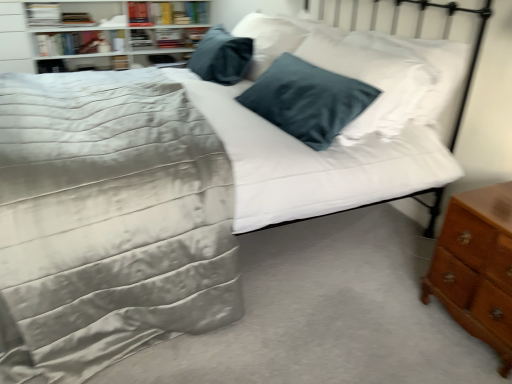
Question: From the image's perspective, is brown wooden nightstand at lower right located beneath white glossy bookshelf at upper left?

Choices:
 (A) no
 (B) yes

Answer: (B)

Question: From a real-world perspective, is brown wooden nightstand at lower right over white glossy bookshelf at upper left?

Choices:
 (A) yes
 (B) no

Answer: (B)

Question: Is brown wooden nightstand at lower right surrounding white glossy bookshelf at upper left?

Choices:
 (A) yes
 (B) no

Answer: (B)

Question: Can you confirm if brown wooden nightstand at lower right is bigger than white glossy bookshelf at upper left?

Choices:
 (A) no
 (B) yes

Answer: (A)

Question: Is brown wooden nightstand at lower right wider than white glossy bookshelf at upper left?

Choices:
 (A) no
 (B) yes

Answer: (A)

Question: From the image's perspective, is hardcover book at upper left, positioned as the 4th book in left-to-right order, located above or below hardcover book at upper left, the second book when ordered from left to right?

Choices:
 (A) above
 (B) below

Answer: (A)

Question: In the image, is hardcover book at upper left, positioned as the 4th book in left-to-right order, positioned in front of or behind hardcover book at upper left, which is the third book from right to left?

Choices:
 (A) front
 (B) behind

Answer: (B)

Question: Considering the positions of point (164, 16) and point (58, 34), is point (164, 16) closer or farther from the camera than point (58, 34)?

Choices:
 (A) closer
 (B) farther

Answer: (B)

Question: Is hardcover book at upper left, positioned as the 4th book in left-to-right order, spatially inside hardcover book at upper left, which is the third book from right to left, or outside of it?

Choices:
 (A) outside
 (B) inside

Answer: (A)

Question: Relative to hardcover book at upper left, the 3th book positioned from the left, is brown wooden nightstand at lower right in front or behind?

Choices:
 (A) front
 (B) behind

Answer: (A)

Question: Is brown wooden nightstand at lower right to the left or to the right of hardcover book at upper left, the 3th book positioned from the left, in the image?

Choices:
 (A) left
 (B) right

Answer: (B)

Question: Which is correct: brown wooden nightstand at lower right is inside hardcover book at upper left, the 3th book positioned from the left, or outside of it?

Choices:
 (A) outside
 (B) inside

Answer: (A)

Question: Considering the positions of brown wooden nightstand at lower right and hardcover book at upper left, which appears as the 2th book when viewed from the right, in the image, is brown wooden nightstand at lower right wider or thinner than hardcover book at upper left, which appears as the 2th book when viewed from the right,?

Choices:
 (A) wide
 (B) thin

Answer: (A)

Question: From the image's perspective, relative to white glossy bookshelf at upper left, is brown wooden nightstand at lower right above or below?

Choices:
 (A) above
 (B) below

Answer: (B)

Question: In the image, is brown wooden nightstand at lower right positioned in front of or behind white glossy bookshelf at upper left?

Choices:
 (A) front
 (B) behind

Answer: (A)